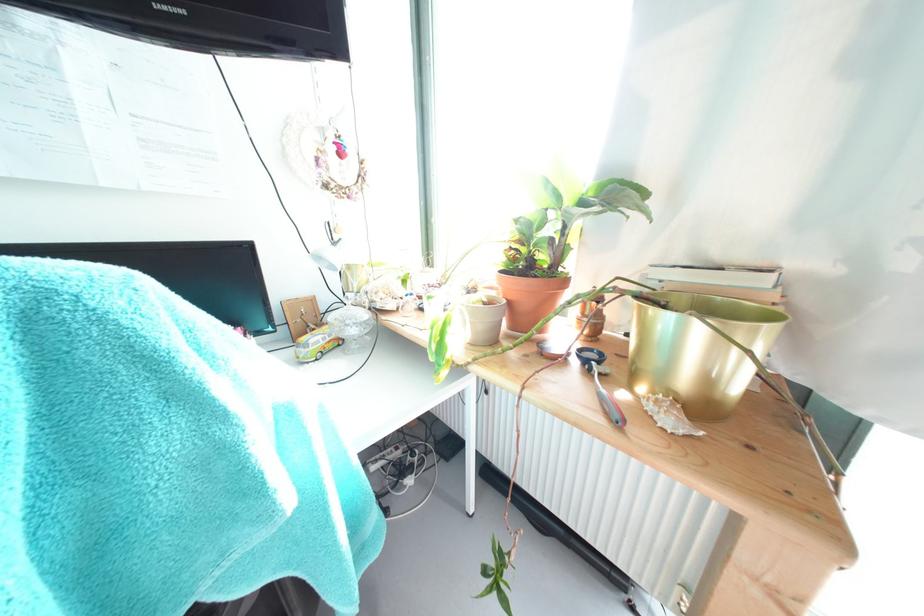
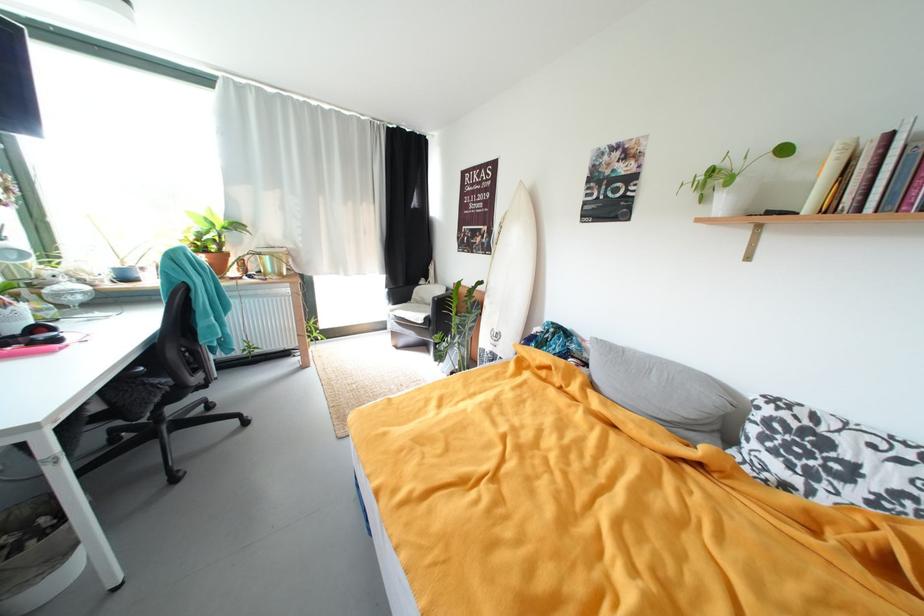
Locate, in the second image, the point that corresponds to pixel 726 257 in the first image.

(281, 246)